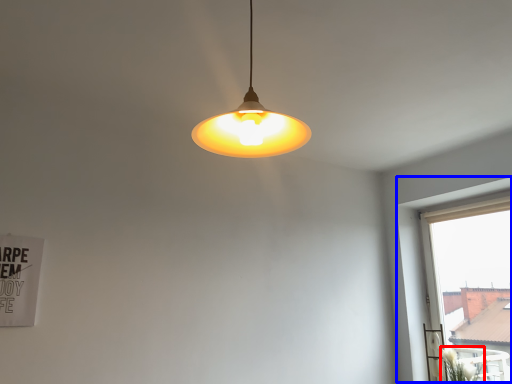
Question: Which object appears farthest to the camera in this image, plant (highlighted by a red box) or window (highlighted by a blue box)?

Choices:
 (A) plant
 (B) window

Answer: (A)